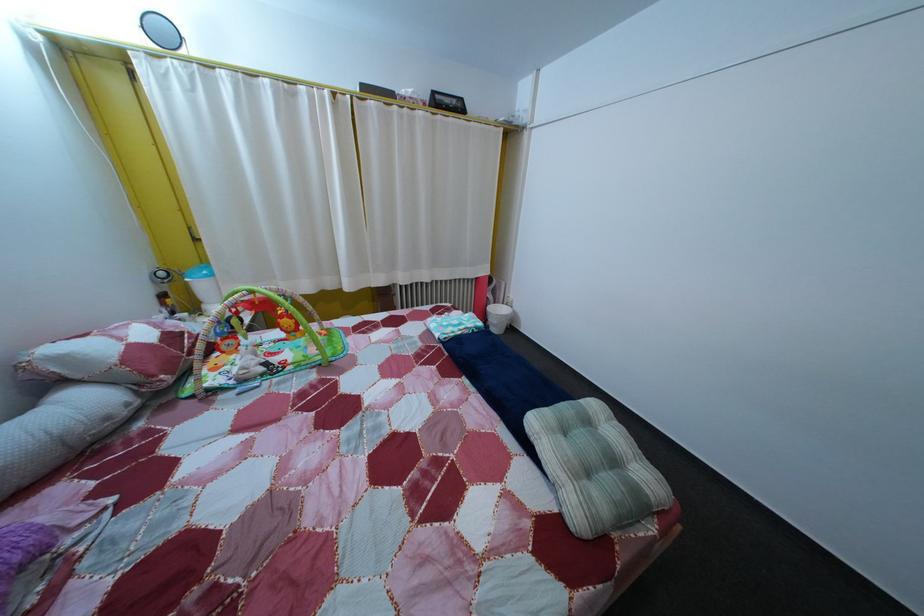
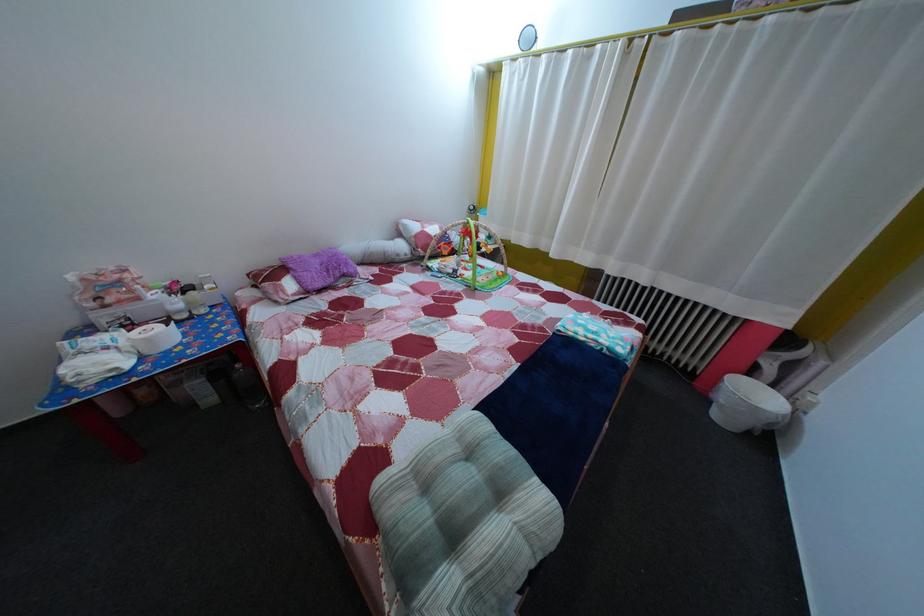
The first image is from the beginning of the video and the second image is from the end. How did the camera likely rotate when shooting the video?

The camera's rotation is toward left-down.